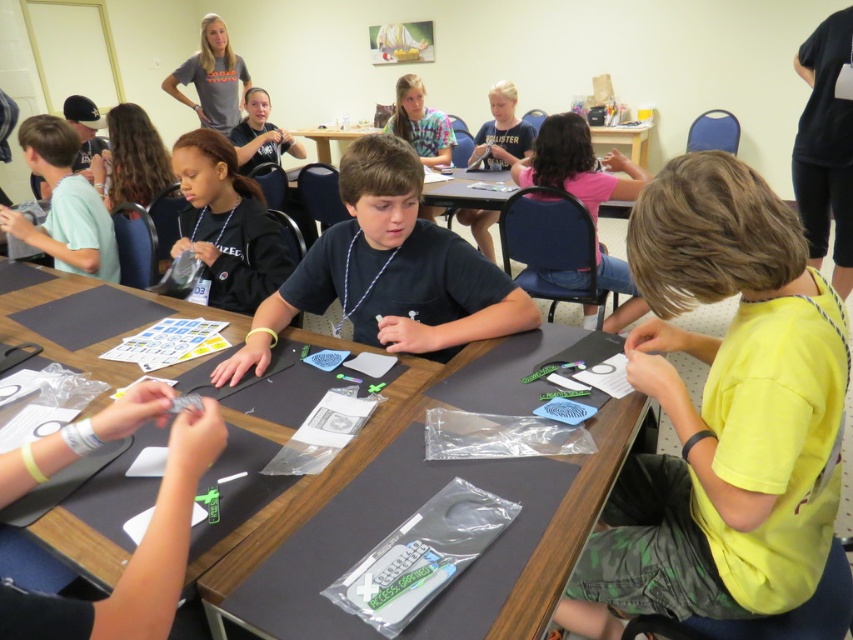
Based on the photo, does wooden table at center come in front of dark blue shirt at center?

Yes, wooden table at center is closer to the viewer.

Can you confirm if wooden table at center is bigger than dark blue shirt at center?

Indeed, wooden table at center has a larger size compared to dark blue shirt at center.

Is point (527, 596) farther from viewer compared to point (421, 349)?

No, (527, 596) is closer to viewer.

Identify the location of wooden table at center. This screenshot has height=640, width=853. (323, 477).

Can you confirm if yellow matte shirt at center is positioned to the right of pink fabric shirt at upper center?

No, yellow matte shirt at center is not to the right of pink fabric shirt at upper center.

Looking at this image, can you confirm if yellow matte shirt at center is thinner than pink fabric shirt at upper center?

Indeed, yellow matte shirt at center has a lesser width compared to pink fabric shirt at upper center.

Image resolution: width=853 pixels, height=640 pixels. I want to click on yellow matte shirt at center, so click(x=721, y=413).

Is yellow matte shirt at center bigger than black matte necklace at center?

Answer: Yes.

Measure the distance between yellow matte shirt at center and black matte necklace at center.

The distance of yellow matte shirt at center from black matte necklace at center is 4.22 feet.

In order to click on yellow matte shirt at center in this screenshot , I will do `click(721, 413)`.